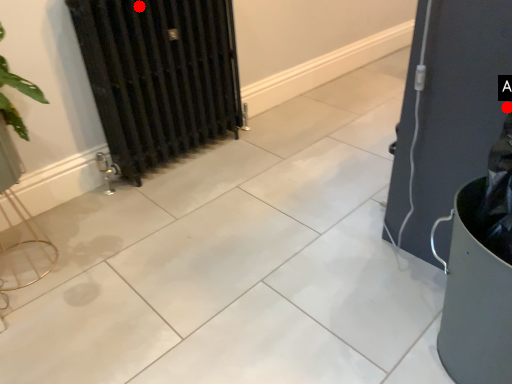
Question: Two points are circled on the image, labeled by A and B beside each circle. Which of the following is the farthest from the observer?

Choices:
 (A) A is further
 (B) B is further

Answer: (B)